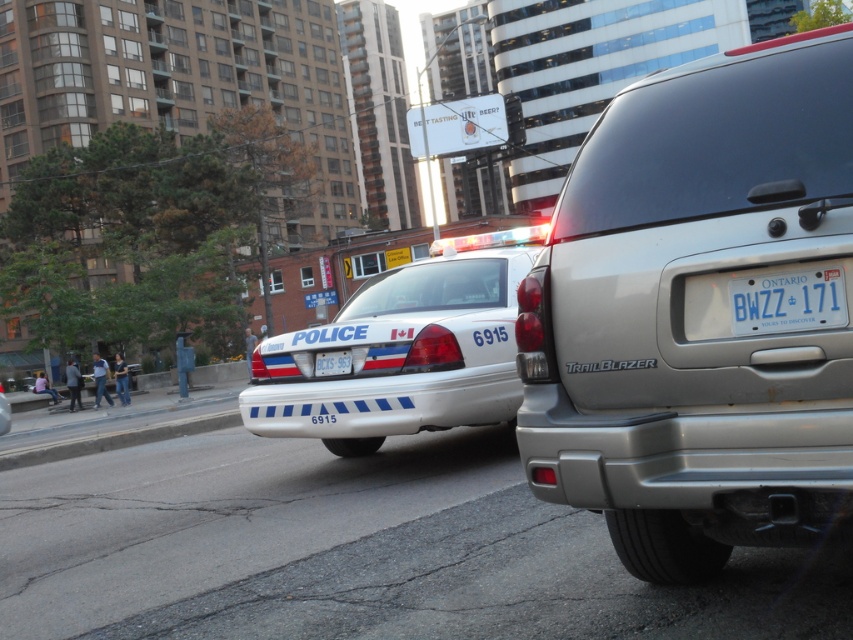
Is satin silver suv at center thinner than white glossy police car at center?

Indeed, satin silver suv at center has a lesser width compared to white glossy police car at center.

Does point (814, 134) lie in front of point (254, 408)?

Yes, it is in front of point (254, 408).

The width and height of the screenshot is (853, 640). I want to click on satin silver suv at center, so click(x=695, y=310).

Which of these two, blue plastic license plate at center or white plastic license plate at rear, stands taller?

With more height is blue plastic license plate at center.

Does blue plastic license plate at center appear on the right side of white plastic license plate at rear?

Yes, blue plastic license plate at center is to the right of white plastic license plate at rear.

Is point (799, 292) in front of point (329, 360)?

Yes, it is in front of point (329, 360).

Identify the location of blue plastic license plate at center. Image resolution: width=853 pixels, height=640 pixels. (x=787, y=301).

Who is lower down, white glossy police car at center or white plastic license plate at rear?

white plastic license plate at rear is lower down.

Is white glossy police car at center shorter than white plastic license plate at rear?

Incorrect, white glossy police car at center's height does not fall short of white plastic license plate at rear's.

Looking at this image, measure the distance between point [309,387] and camera.

Point [309,387] is 6.72 meters away from camera.

The width and height of the screenshot is (853, 640). I want to click on white glossy police car at center, so click(x=399, y=356).